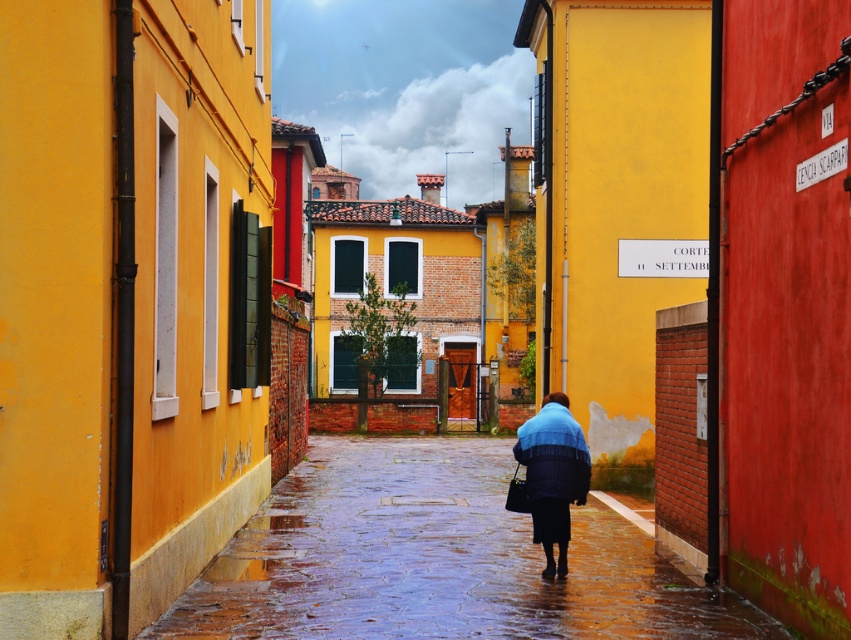
Between wet stone pavement at center and blue fuzzy coat at center, which one is positioned higher?

blue fuzzy coat at center is higher up.

Does point (368, 588) come in front of point (552, 502)?

Yes.

Which is in front, point (592, 525) or point (584, 440)?

Positioned in front is point (584, 440).

At what (x,y) coordinates should I click in order to perform the action: click on wet stone pavement at center. Please return your answer as a coordinate pair (x, y). This screenshot has width=851, height=640. Looking at the image, I should click on (437, 557).